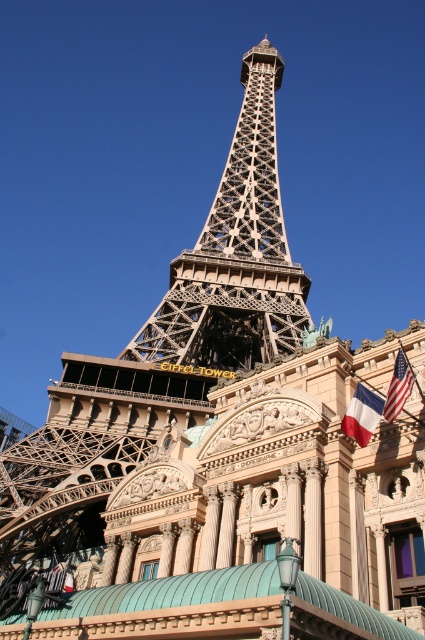
Question: Which point is closer to the camera taking this photo?

Choices:
 (A) click(235, 132)
 (B) click(365, 433)
 (C) click(393, 401)

Answer: (C)

Question: Which object is farther from the camera taking this photo?

Choices:
 (A) metallic lattice structure at center
 (B) american flag at upper right

Answer: (A)

Question: Based on their relative distances, which object is farther from the metallic lattice structure at center?

Choices:
 (A) red fabric flag at right
 (B) american flag at upper right

Answer: (B)

Question: Can you confirm if metallic lattice structure at center is positioned below red fabric flag at right?

Choices:
 (A) no
 (B) yes

Answer: (A)

Question: In this image, where is metallic lattice structure at center located relative to american flag at upper right?

Choices:
 (A) left
 (B) right

Answer: (A)

Question: Is red fabric flag at right closer to the viewer compared to american flag at upper right?

Choices:
 (A) no
 (B) yes

Answer: (A)